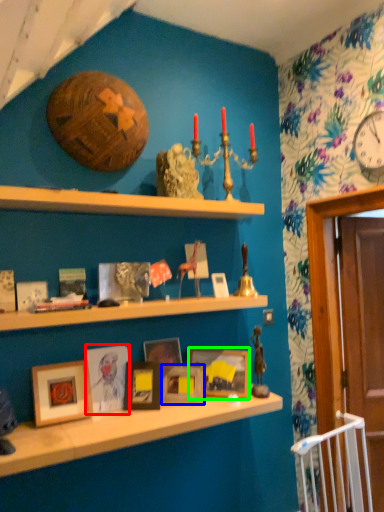
Question: Based on their relative distances, which object is nearer to picture frame (highlighted by a red box)? Choose from picture frame (highlighted by a blue box) and picture frame (highlighted by a green box).

Choices:
 (A) picture frame
 (B) picture frame

Answer: (A)